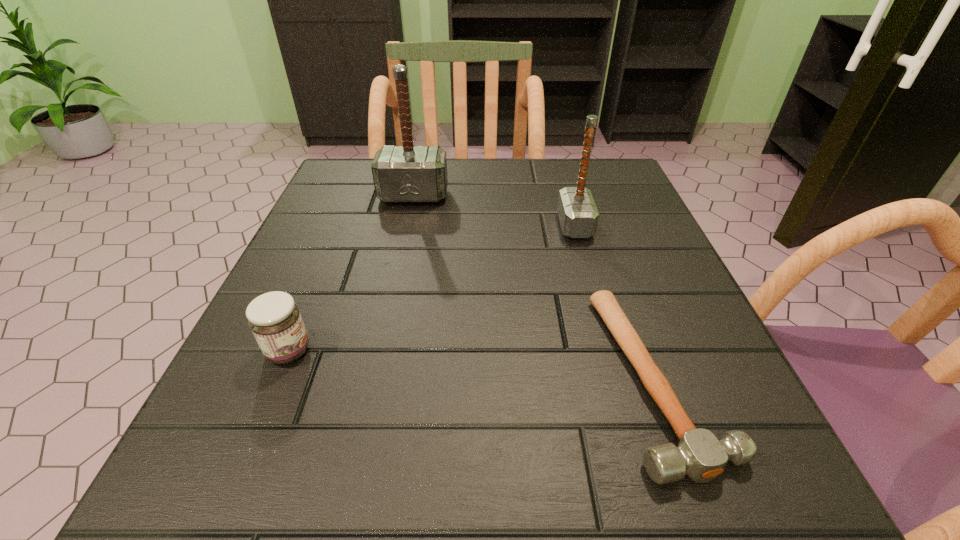
I want to click on the third object from right to left, so click(x=405, y=174).

You are a GUI agent. You are given a task and a screenshot of the screen. Output one action in this format:
    pyautogui.click(x=<x>, y=<y>)
    Task: Click on the leftmost hammer
    The height and width of the screenshot is (540, 960).
    Given the screenshot: What is the action you would take?
    pyautogui.click(x=405, y=174)

I want to click on the second tallest object, so click(578, 215).

This screenshot has width=960, height=540. In order to click on the second nearest hammer in this screenshot , I will do `click(578, 215)`.

Find the location of a particular element. Image resolution: width=960 pixels, height=540 pixels. the leftmost object is located at coordinates (274, 318).

Find the location of a particular element. This screenshot has width=960, height=540. the second shortest object is located at coordinates (274, 318).

Image resolution: width=960 pixels, height=540 pixels. I want to click on the shortest hammer, so click(x=699, y=454).

The height and width of the screenshot is (540, 960). I want to click on the nearest hammer, so click(699, 454).

Where is `free space located on the right of the farthest object`? This screenshot has height=540, width=960. free space located on the right of the farthest object is located at coordinates (492, 196).

At what (x,y) coordinates should I click in order to perform the action: click on vacant space positioned on the striking surface of the second nearest hammer. Please return your answer as a coordinate pair (x, y). Looking at the image, I should click on (495, 226).